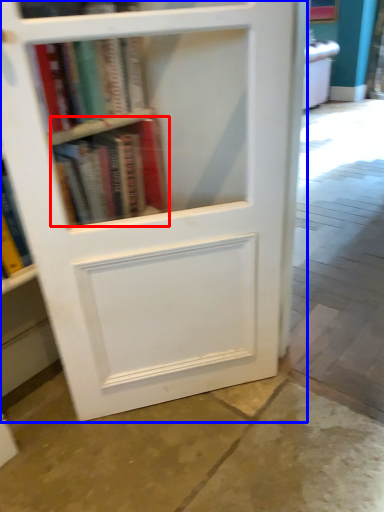
Question: Which of the following is the farthest to the observer, book (highlighted by a red box) or bookcase (highlighted by a blue box)?

Choices:
 (A) book
 (B) bookcase

Answer: (A)